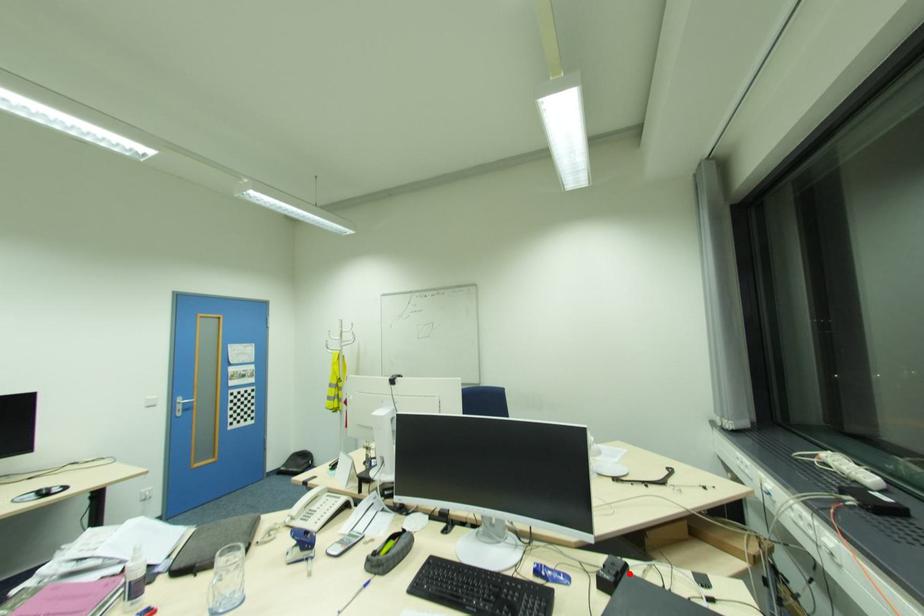
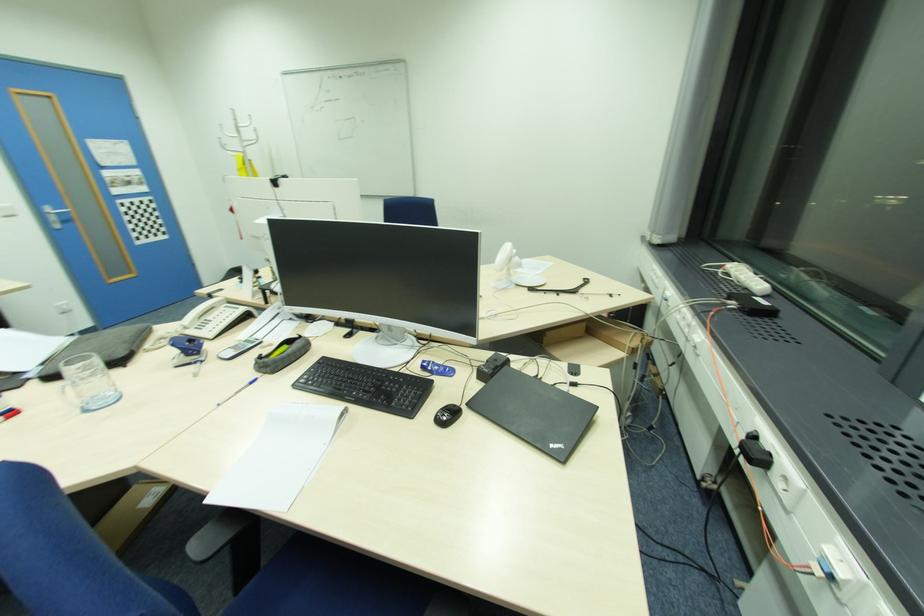
Find the pixel in the second image that matches the highlighted location in the first image.

(508, 367)